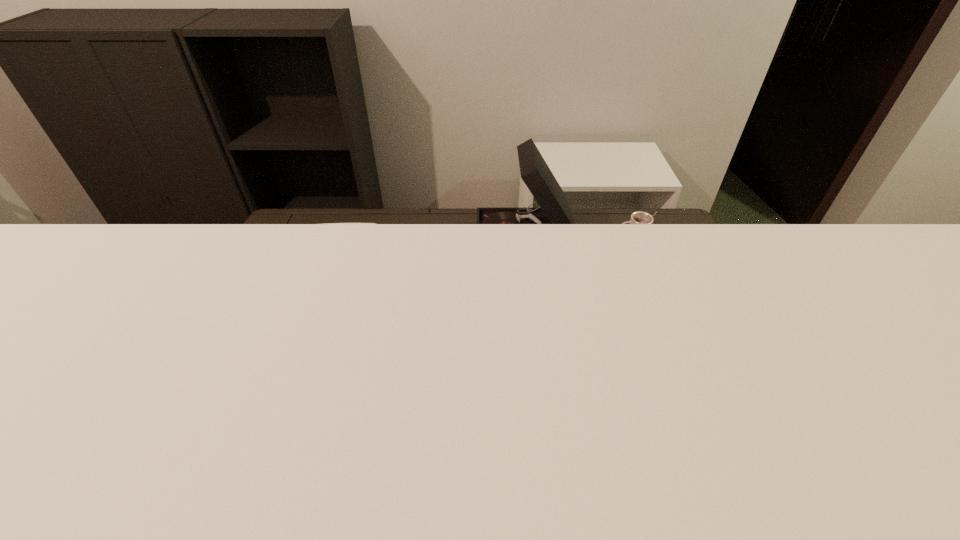
At what (x,y) coordinates should I click in order to perform the action: click on free space located on the side with the handle of the shortest object. Please return your answer as a coordinate pair (x, y). Looking at the image, I should click on (580, 240).

Find the location of a particular element. Image resolution: width=960 pixels, height=540 pixels. vacant space located 0.290m on the side with the handle of the shortest object is located at coordinates (536, 240).

Where is `free spot located on the side with the handle of the shortest object`? The width and height of the screenshot is (960, 540). free spot located on the side with the handle of the shortest object is located at coordinates (555, 240).

The height and width of the screenshot is (540, 960). Identify the location of phonograph_record that is at the far edge. (555, 208).

Image resolution: width=960 pixels, height=540 pixels. Identify the location of cash register at the far edge. (326, 223).

You are a GUI agent. You are given a task and a screenshot of the screen. Output one action in this format:
    pyautogui.click(x=<x>, y=<y>)
    Task: Click on the cup at the far edge
    
    Given the screenshot: What is the action you would take?
    point(639,217)

Locate an element on the screen. This screenshot has height=540, width=960. object present at the left edge is located at coordinates (326, 223).

Where is `object that is at the right edge`? This screenshot has height=540, width=960. object that is at the right edge is located at coordinates (639, 217).

Identify the location of object located at the far left corner. (326, 223).

The image size is (960, 540). What are the coordinates of `object that is at the far right corner` in the screenshot? It's located at (639, 217).